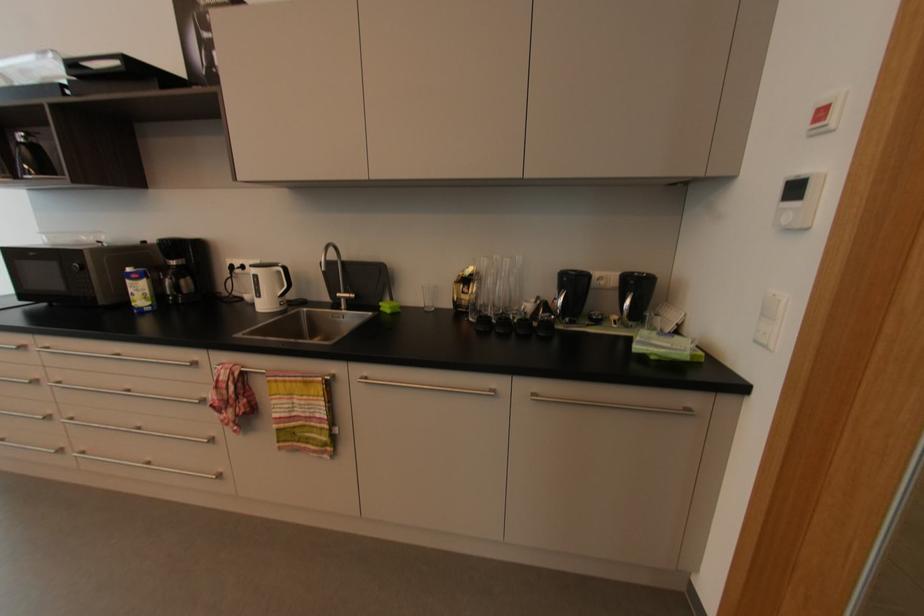
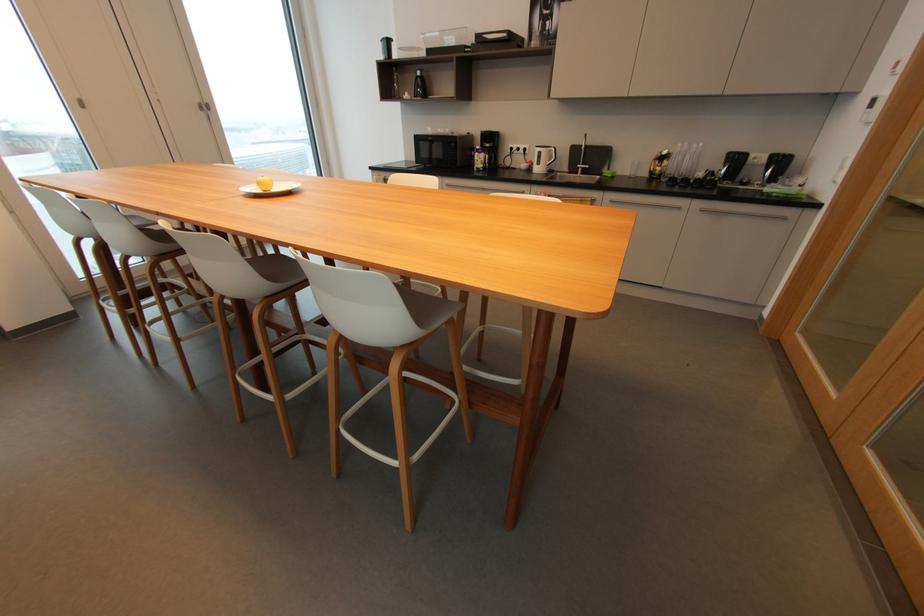
Where in the second image is the point corresponding to the point at 493,313 from the first image?

(678, 177)